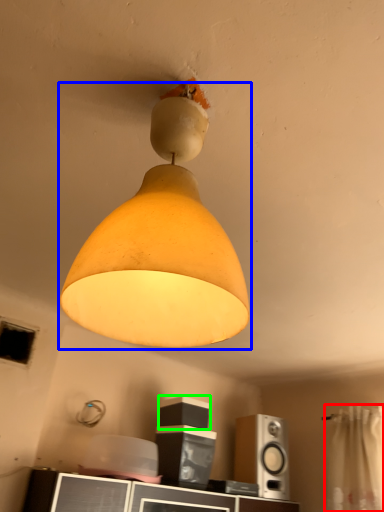
Question: Which object is positioned farthest from curtain (highlighted by a red box)? Select from lamp (highlighted by a blue box) and speaker (highlighted by a green box).

Choices:
 (A) lamp
 (B) speaker

Answer: (A)